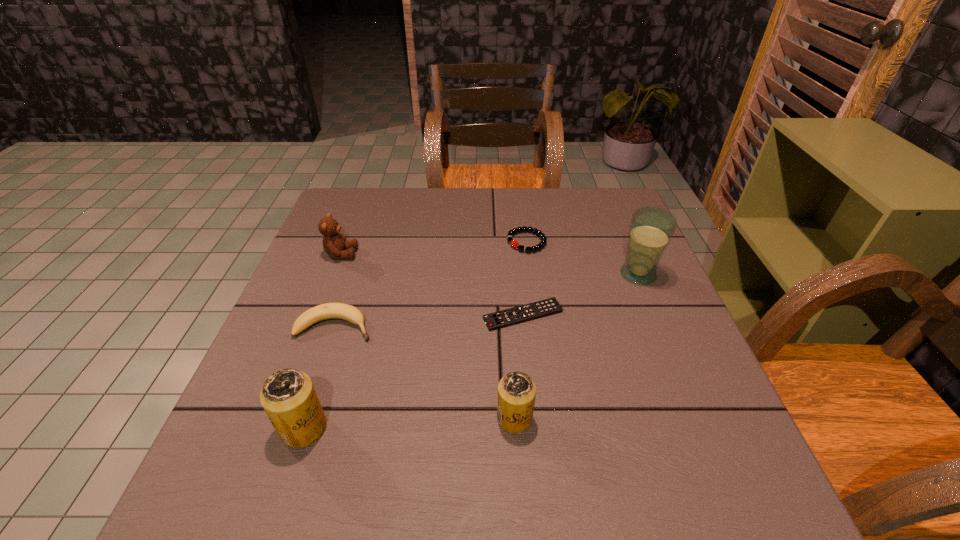
I want to click on object that is at the right edge, so click(x=651, y=228).

Locate an element on the screen. This screenshot has height=540, width=960. object that is at the near left corner is located at coordinates 288,396.

Identify the location of vacant area at the far edge. Image resolution: width=960 pixels, height=540 pixels. tap(544, 222).

Identify the location of vacant space at the near edge of the desktop. This screenshot has width=960, height=540. (625, 434).

Locate an element on the screen. This screenshot has height=540, width=960. vacant space at the left edge of the desktop is located at coordinates (253, 386).

In the image, there is a desktop. At what (x,y) coordinates should I click in order to perform the action: click on vacant area at the right edge. Please return your answer as a coordinate pair (x, y). Image resolution: width=960 pixels, height=540 pixels. Looking at the image, I should click on (619, 352).

Find the location of a particular element. Image resolution: width=960 pixels, height=540 pixels. vacant area at the far right corner of the desktop is located at coordinates (596, 211).

Identify the location of free area in between the remote control and the right beer can. The height and width of the screenshot is (540, 960). (518, 367).

Where is `free spot between the tallest object and the sixth shortest object`? The image size is (960, 540). free spot between the tallest object and the sixth shortest object is located at coordinates (470, 352).

Image resolution: width=960 pixels, height=540 pixels. I want to click on vacant area between the left beer can and the remote control, so click(x=414, y=372).